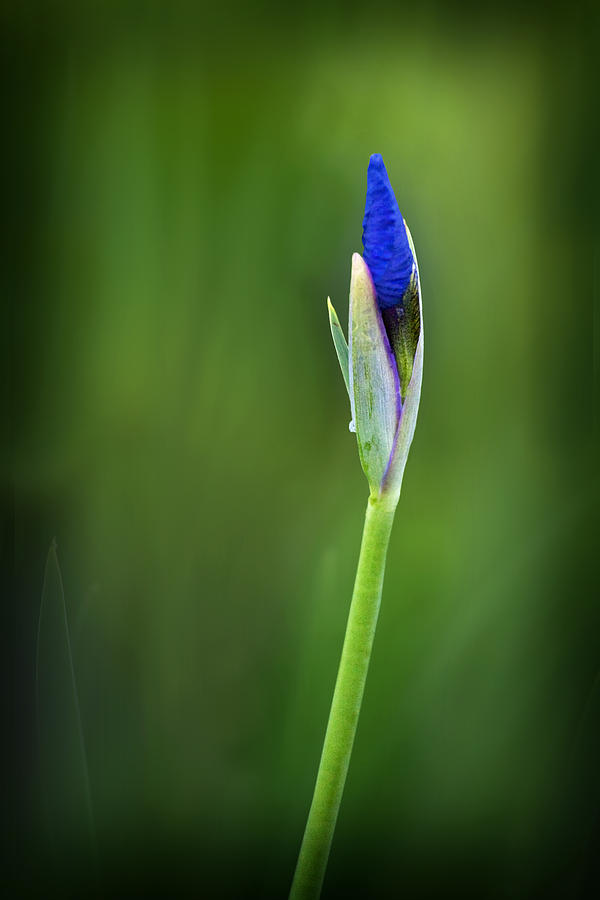
Locate an element on the screen. The image size is (600, 900). blue bulb is located at coordinates (388, 272).